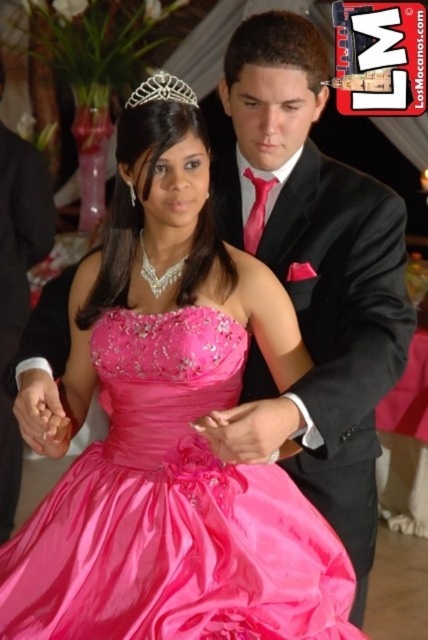
Question: Among these points, which one is farthest from the camera?

Choices:
 (A) (9, 157)
 (B) (168, 74)

Answer: (A)

Question: Which of these objects is positioned farthest from the shiny taffeta dress at center?

Choices:
 (A) silver metallic tiara at upper center
 (B) black satin suit at center

Answer: (B)

Question: In this image, where is shiny taffeta dress at center located relative to black satin suit at center?

Choices:
 (A) below
 (B) above

Answer: (A)

Question: Among these points, which one is farthest from the camera?

Choices:
 (A) click(183, 90)
 (B) click(6, 218)
 (C) click(5, 596)

Answer: (B)

Question: Is shiny taffeta dress at center closer to camera compared to silver metallic tiara at upper center?

Choices:
 (A) no
 (B) yes

Answer: (B)

Question: Does shiny taffeta dress at center appear under black satin suit at center?

Choices:
 (A) yes
 (B) no

Answer: (A)